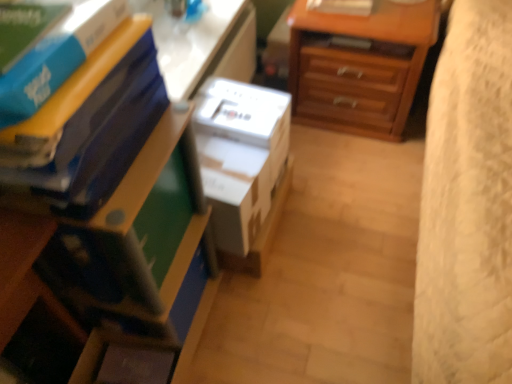
You are a GUI agent. You are given a task and a screenshot of the screen. Output one action in this format:
    pyautogui.click(x=<x>, y=<y>)
    Task: Click on the free space in front of wooden chest of drawers at upper right
    This screenshot has height=384, width=512.
    Given the screenshot: What is the action you would take?
    pyautogui.click(x=356, y=171)